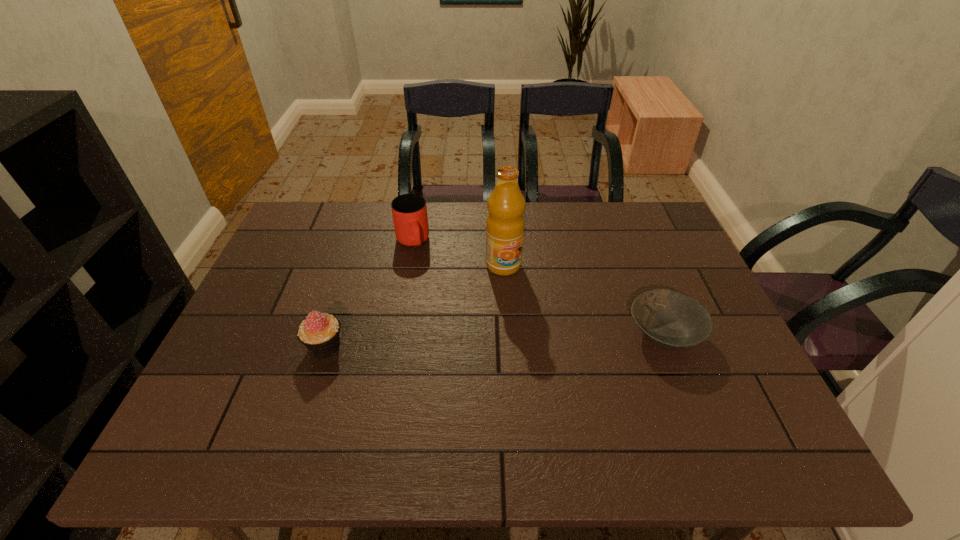
Locate an element on the screen. free location located 0.130m on the handle side of the third object from right to left is located at coordinates (425, 284).

This screenshot has width=960, height=540. Identify the location of blank space located 0.180m on the front label of the tallest object. (535, 321).

The height and width of the screenshot is (540, 960). What are the coordinates of `free location located on the front label of the tallest object` in the screenshot? It's located at (544, 338).

Identify the location of vacant region located on the front label of the tallest object. (527, 308).

You are a GUI agent. You are given a task and a screenshot of the screen. Output one action in this format:
    pyautogui.click(x=<x>, y=<y>)
    Task: Click on the object at the far edge
    Image resolution: width=960 pixels, height=540 pixels.
    Given the screenshot: What is the action you would take?
    409,211

I want to click on object that is at the right edge, so click(x=671, y=320).

In the image, there is a desktop. What are the coordinates of `vacant space at the far edge` in the screenshot? It's located at (583, 233).

What are the coordinates of `vacant area at the near edge` in the screenshot? It's located at (620, 390).

Identify the location of free space at the left edge. The image size is (960, 540). (226, 355).

At what (x,y) coordinates should I click in order to perform the action: click on free space at the right edge of the desktop. Please return your answer as a coordinate pair (x, y). Looking at the image, I should click on (739, 362).